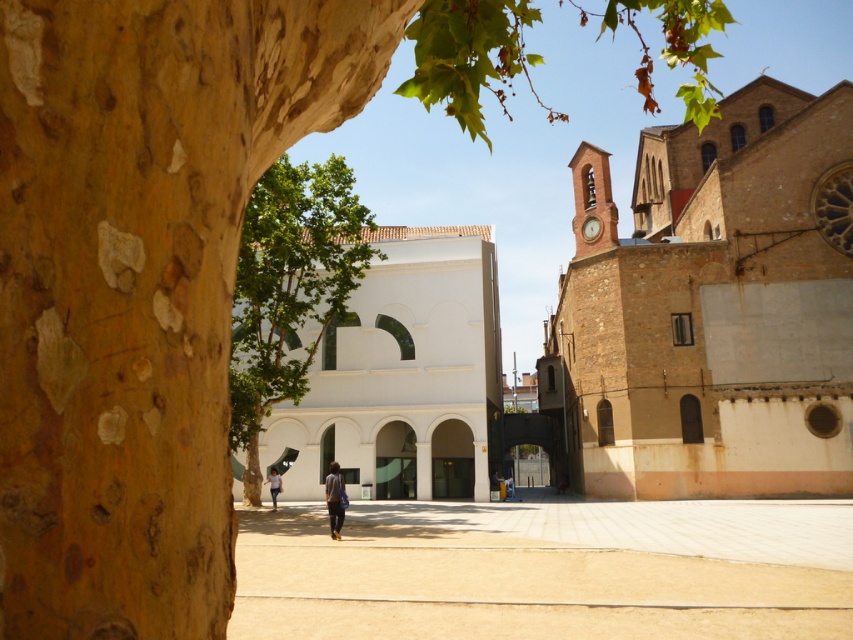
Is brown brick church at upper right taller than light brown leather jacket at center?

Correct, brown brick church at upper right is much taller as light brown leather jacket at center.

Between brown brick church at upper right and light brown leather jacket at center, which one is positioned higher?

brown brick church at upper right is above.

Locate an element on the screen. This screenshot has height=640, width=853. brown brick church at upper right is located at coordinates (712, 307).

Where is `brown brick church at upper right`? This screenshot has width=853, height=640. brown brick church at upper right is located at coordinates (712, 307).

Between point (328, 506) and point (277, 483), which one is positioned behind?

Positioned behind is point (277, 483).

Is denim jacket at center taller than light brown leather jacket at center?

Correct, denim jacket at center is much taller as light brown leather jacket at center.

At what (x,y) coordinates should I click in order to perform the action: click on denim jacket at center. Please return your answer as a coordinate pair (x, y). Looking at the image, I should click on (334, 499).

Locate an element on the screen. The image size is (853, 640). brown brick church at upper right is located at coordinates (712, 307).

Can you confirm if brown brick church at upper right is positioned above denim jacket at center?

Yes.

This screenshot has height=640, width=853. Describe the element at coordinates (712, 307) in the screenshot. I see `brown brick church at upper right` at that location.

The height and width of the screenshot is (640, 853). Find the location of `brown brick church at upper right`. brown brick church at upper right is located at coordinates (712, 307).